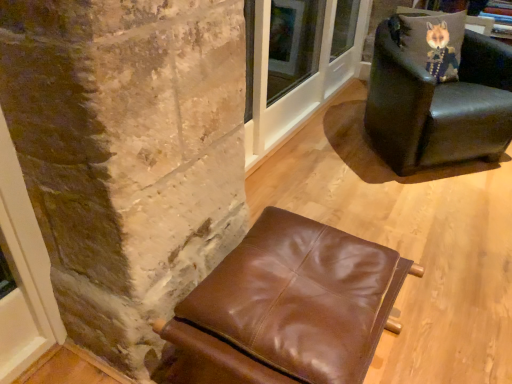
Question: Is velvet fox pillow at upper right at the back of leather armchair at upper right, marked as the first chair in a back-to-front arrangement?

Choices:
 (A) yes
 (B) no

Answer: (A)

Question: From the image's perspective, does leather armchair at upper right, the first chair viewed from the right, appear lower than velvet fox pillow at upper right?

Choices:
 (A) no
 (B) yes

Answer: (B)

Question: From a real-world perspective, is leather armchair at upper right, marked as the first chair in a back-to-front arrangement, positioned over velvet fox pillow at upper right based on gravity?

Choices:
 (A) yes
 (B) no

Answer: (B)

Question: Is leather armchair at upper right, the first chair viewed from the right, closer to the viewer compared to velvet fox pillow at upper right?

Choices:
 (A) yes
 (B) no

Answer: (A)

Question: Is velvet fox pillow at upper right inside leather armchair at upper right, the first chair viewed from the right?

Choices:
 (A) yes
 (B) no

Answer: (A)

Question: Is leather armchair at upper right, the 1th chair viewed from the top, to the right of velvet fox pillow at upper right from the viewer's perspective?

Choices:
 (A) yes
 (B) no

Answer: (A)

Question: Is velvet fox pillow at upper right thinner than leather armchair at upper right, the 2th chair from the left?

Choices:
 (A) yes
 (B) no

Answer: (A)

Question: Is velvet fox pillow at upper right wider than leather armchair at upper right, the second chair ordered from the bottom?

Choices:
 (A) yes
 (B) no

Answer: (B)

Question: Does velvet fox pillow at upper right turn towards leather armchair at upper right, marked as the 2th chair in a front-to-back arrangement?

Choices:
 (A) no
 (B) yes

Answer: (B)

Question: Considering the relative sizes of velvet fox pillow at upper right and leather armchair at upper right, marked as the 2th chair in a front-to-back arrangement, in the image provided, is velvet fox pillow at upper right smaller than leather armchair at upper right, marked as the 2th chair in a front-to-back arrangement,?

Choices:
 (A) yes
 (B) no

Answer: (A)

Question: Is velvet fox pillow at upper right far from leather armchair at upper right, the first chair viewed from the right?

Choices:
 (A) no
 (B) yes

Answer: (A)

Question: Can you confirm if velvet fox pillow at upper right is positioned to the left of leather armchair at upper right, marked as the 2th chair in a front-to-back arrangement?

Choices:
 (A) no
 (B) yes

Answer: (B)

Question: Considering the relative sizes of brown leather ottoman at lower center, the first chair in the left-to-right sequence, and velvet fox pillow at upper right in the image provided, is brown leather ottoman at lower center, the first chair in the left-to-right sequence, taller than velvet fox pillow at upper right?

Choices:
 (A) no
 (B) yes

Answer: (B)